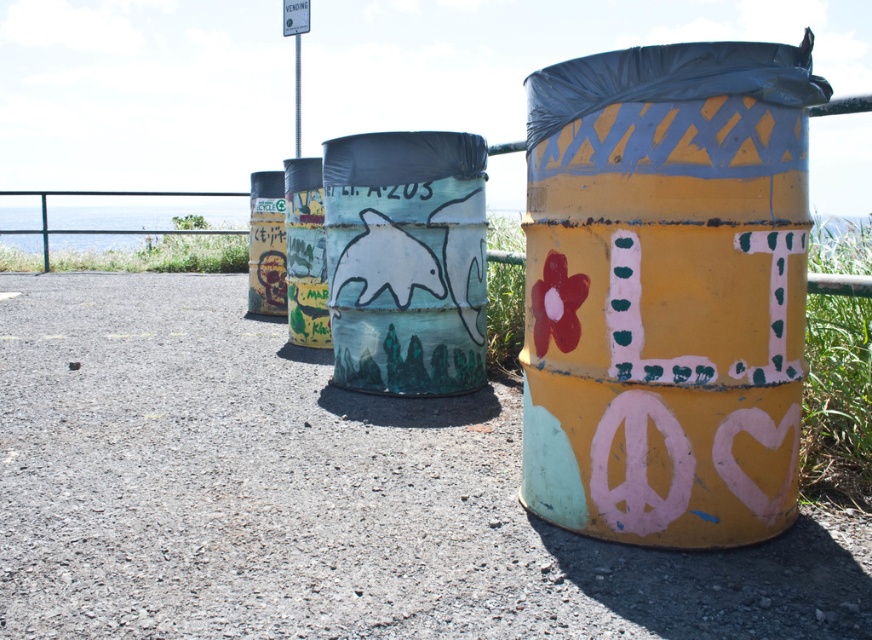
Question: Does metallic yellow barrel at center have a lesser width compared to metallic graffiti can at left?

Choices:
 (A) no
 (B) yes

Answer: (B)

Question: Which point is farther from the camera taking this photo?

Choices:
 (A) (298, 273)
 (B) (481, 237)

Answer: (A)

Question: Which point is closer to the camera taking this photo?

Choices:
 (A) (648, 284)
 (B) (346, 163)
 (C) (273, 180)
 (D) (291, 272)

Answer: (A)

Question: Is metallic yellow barrel at center above metallic graffiti can at left?

Choices:
 (A) no
 (B) yes

Answer: (A)

Question: Which of the following is the farthest from the observer?

Choices:
 (A) (302, 310)
 (B) (276, 205)
 (C) (416, 134)

Answer: (B)

Question: Considering the relative positions of yellow matte trash can at right and metallic yellow barrel at center in the image provided, where is yellow matte trash can at right located with respect to metallic yellow barrel at center?

Choices:
 (A) left
 (B) right

Answer: (B)